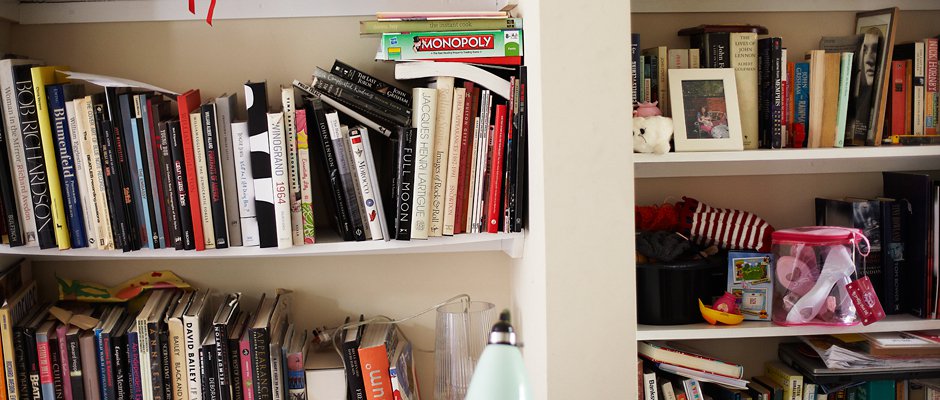
Identify the location of book case backing. The height and width of the screenshot is (400, 940). (151, 54), (364, 277), (768, 193), (662, 18), (752, 352).